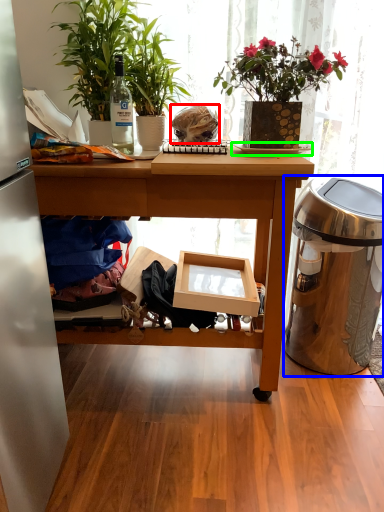
Question: Which is nearer to the food (highlighted by a red box)? trash bin/can (highlighted by a blue box) or plate (highlighted by a green box).

Choices:
 (A) trash bin/can
 (B) plate

Answer: (B)